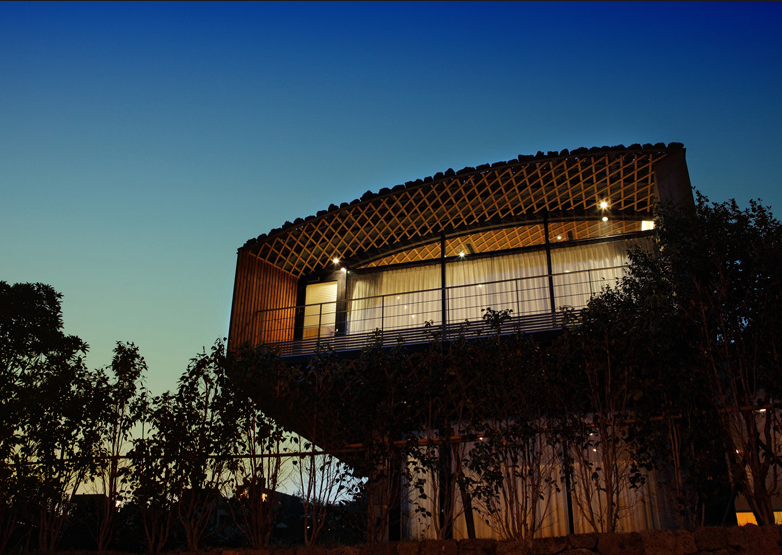
Locate an element on the screen. This screenshot has height=555, width=782. curtains is located at coordinates (496, 272).